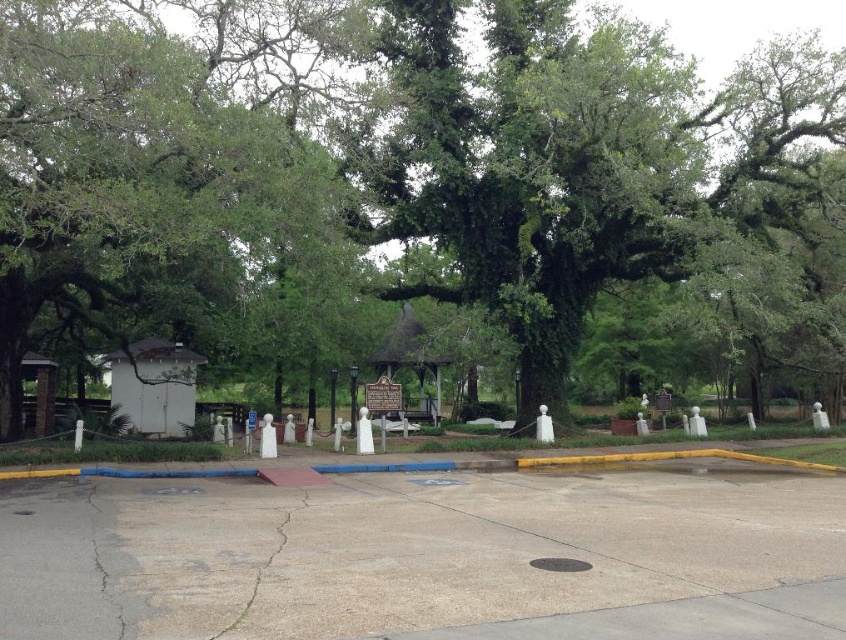
You are a gardener standing in the parking lot and want to water the green leafy tree at center. However, you notice the gray concrete pavement at center is in your way. Can you walk directly to the tree without stepping on the pavement?

The gray concrete pavement at center is behind the green leafy tree at center, so you can walk directly to the tree without stepping on the pavement since the tree is between you and the pavement.

You are standing at the yellow curb in the parking lot and see two points marked in the scene. The first point is at coordinates point (540, 305) and the second is at point (801, 611). Which point is closer to you?

Point (801, 611) is closer to you because it is in front of point (540, 305).

You are planning to park your car in the parking lot. The car is 2 meters wide. The parking space has a gray concrete pavement at center. There is also a green leafy tree at center nearby. Can the car fit between them without hitting the tree?

The green leafy tree at center might be wider than the gray concrete pavement at center, so there is a risk that the car might hit the tree if it is wider than the pavement. It is safer to check the actual width before parking.